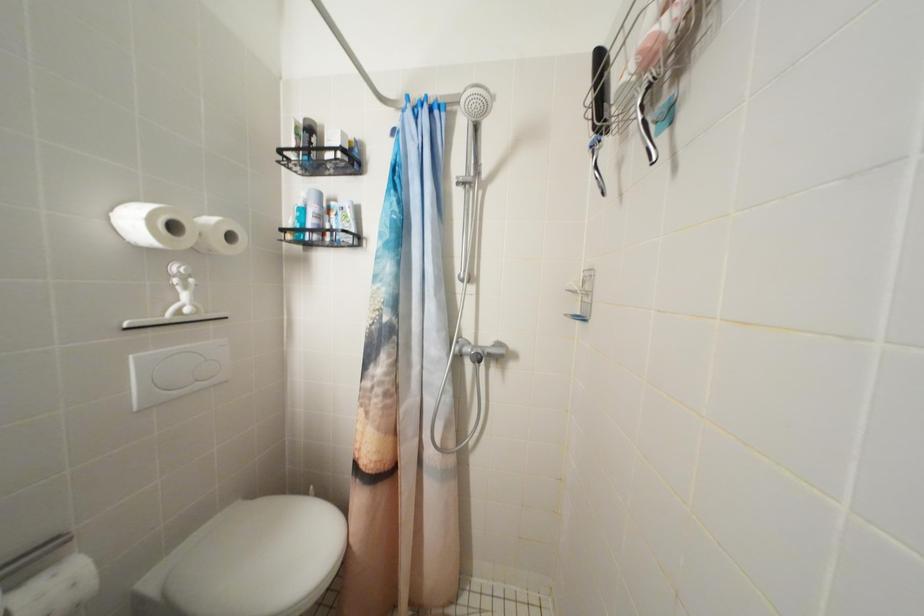
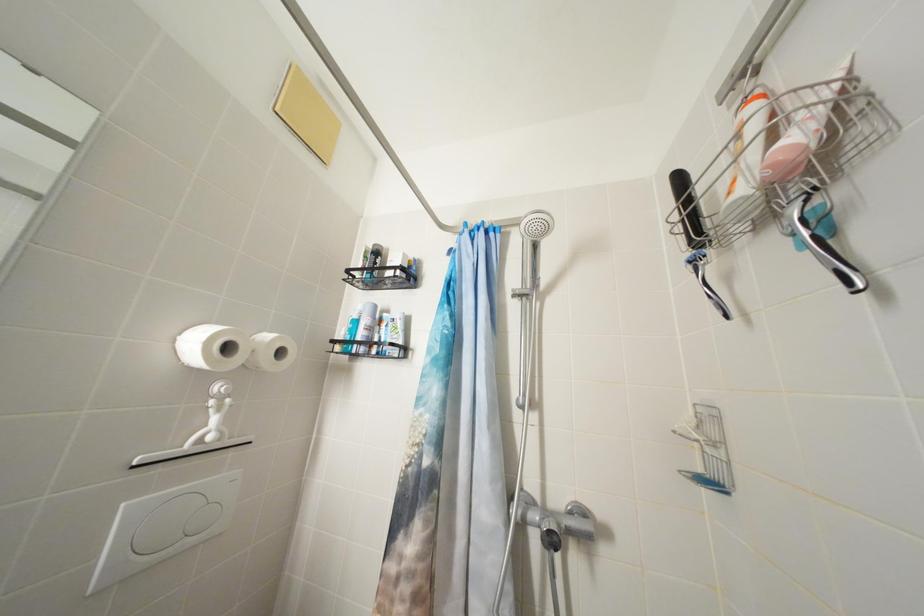
Which direction would the cameraman need to move to produce the second image?

The cameraman moved toward left, forward.